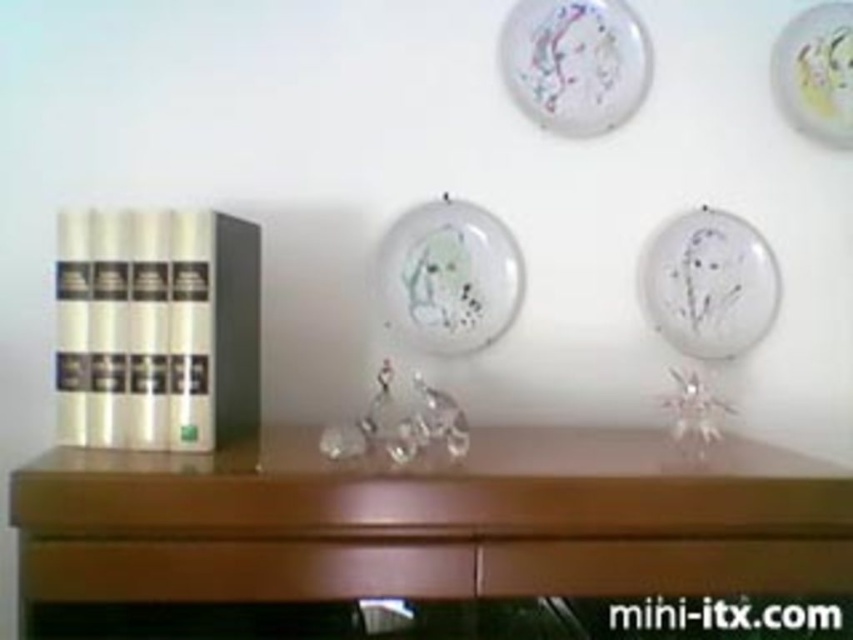
From the picture: You are organizing a shelf and see the porcelain plate at center and the porcelain plate at upper center. Which one is located below the other?

The porcelain plate at center is positioned under the porcelain plate at upper center, so the porcelain plate at center is below the porcelain plate at upper center.

You are arranging items on a shelf and notice two porcelain plates. The porcelain plate at center and the porcelain plate at upper center. Which one is located to the left of the other?

The porcelain plate at center is positioned on the left side of porcelain plate at upper center.

You are organizing items on a shelf and need to place both the wooden drawer at lower center and the white glossy plate at upper right. Given their sizes, which one should you place first to ensure they both fit properly?

The wooden drawer at lower center is larger in size than the white glossy plate at upper right. To ensure both fit properly, you should place the wooden drawer at lower center first, then the white glossy plate at upper right.